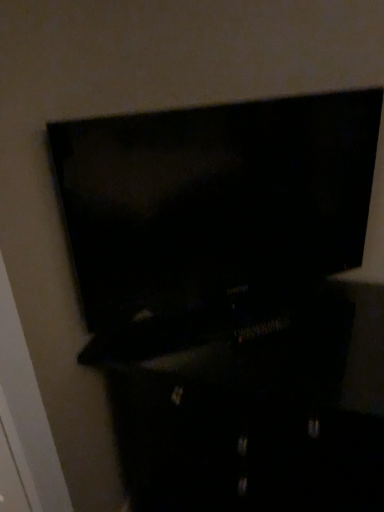
Locate an element on the screen. The width and height of the screenshot is (384, 512). vacant space in front of matte black tv at upper center is located at coordinates (244, 361).